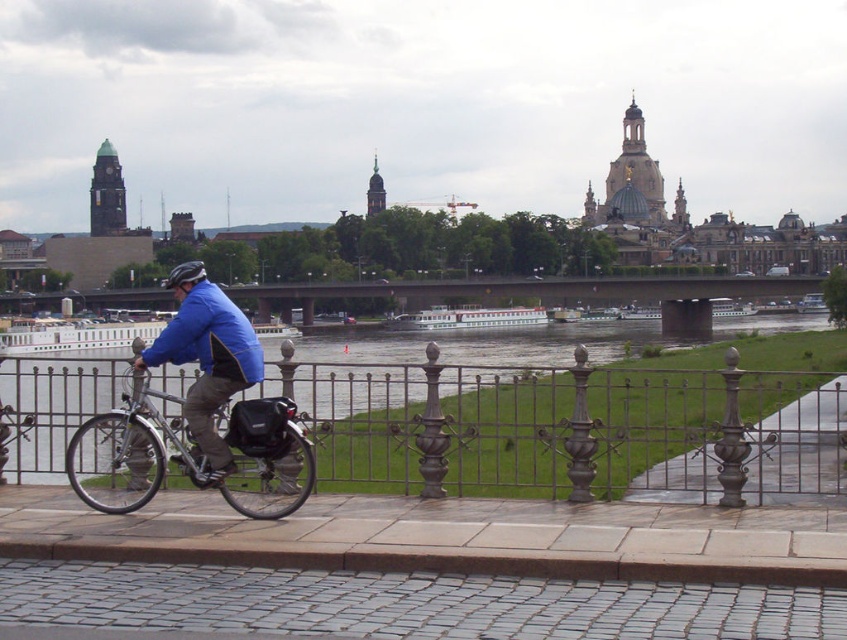
Can you confirm if metallic iron fence at center is positioned below shiny black helmet at center?

Yes.

Between metallic iron fence at center and shiny black helmet at center, which one is positioned higher?

shiny black helmet at center is above.

You are a GUI agent. You are given a task and a screenshot of the screen. Output one action in this format:
    pyautogui.click(x=<x>, y=<y>)
    Task: Click on the metallic iron fence at center
    The height and width of the screenshot is (640, 847).
    Given the screenshot: What is the action you would take?
    pyautogui.click(x=569, y=428)

Can you confirm if silver metallic bicycle at center is taller than shiny black helmet at center?

Incorrect, silver metallic bicycle at center's height is not larger of shiny black helmet at center's.

Can you confirm if silver metallic bicycle at center is smaller than shiny black helmet at center?

Correct, silver metallic bicycle at center occupies less space than shiny black helmet at center.

Between point (272, 480) and point (197, 280), which one is positioned behind?

The point (197, 280) is behind.

Where is `silver metallic bicycle at center`? This screenshot has height=640, width=847. silver metallic bicycle at center is located at coordinates (131, 451).

Does metallic iron fence at center appear over silver metallic bicycle at center?

Incorrect, metallic iron fence at center is not positioned above silver metallic bicycle at center.

Is point (441, 426) positioned behind point (142, 410)?

Yes, point (441, 426) is farther from viewer.

Locate an element on the screen. metallic iron fence at center is located at coordinates (569, 428).